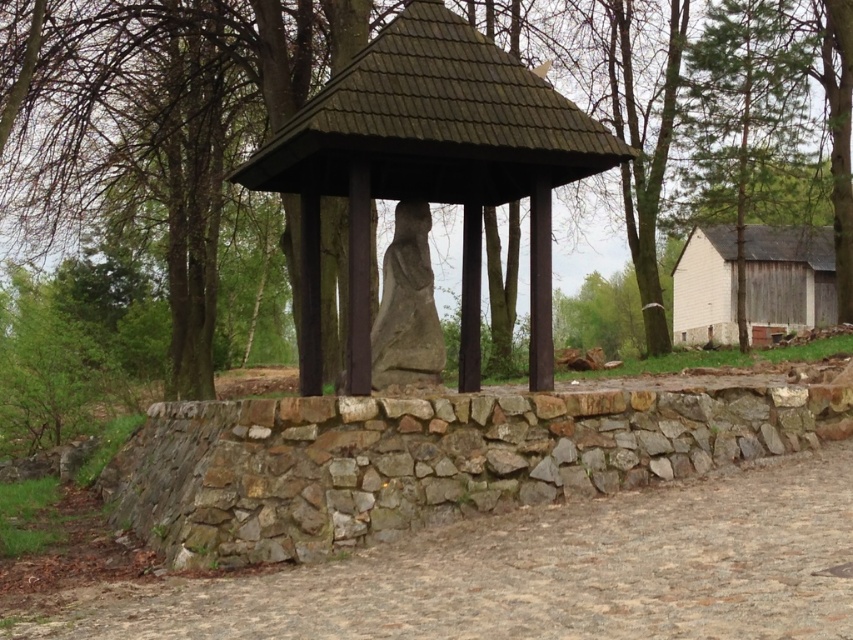
Question: Is white wood barn at right above gray stone statue at center?

Choices:
 (A) yes
 (B) no

Answer: (B)

Question: Estimate the real-world distances between objects in this image. Which object is farther from the green leafy tree at center?

Choices:
 (A) brown cobblestone path at center
 (B) brown wooden gazebo at center
 (C) white wood barn at right

Answer: (C)

Question: Estimate the real-world distances between objects in this image. Which object is closer to the green leafy tree at center?

Choices:
 (A) brown cobblestone path at center
 (B) white wood barn at right
 (C) gray stone statue at center
 (D) brown wooden gazebo at center

Answer: (D)

Question: Does brown wooden gazebo at center appear under gray stone statue at center?

Choices:
 (A) no
 (B) yes

Answer: (A)

Question: Which object is closer to the camera taking this photo?

Choices:
 (A) brown wooden gazebo at center
 (B) white wood barn at right

Answer: (A)

Question: Does brown cobblestone path at center have a larger size compared to gray stone statue at center?

Choices:
 (A) no
 (B) yes

Answer: (A)